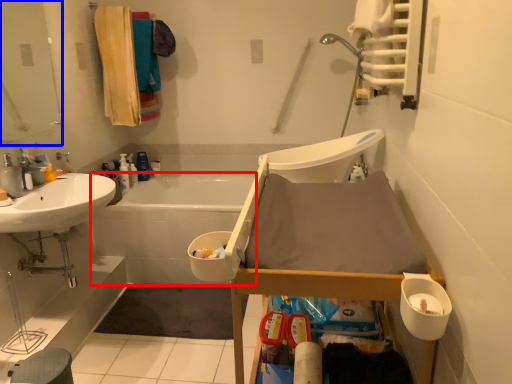
Question: Which point is closer to the camera, bath (highlighted by a red box) or mirror (highlighted by a blue box)?

Choices:
 (A) bath
 (B) mirror

Answer: (B)